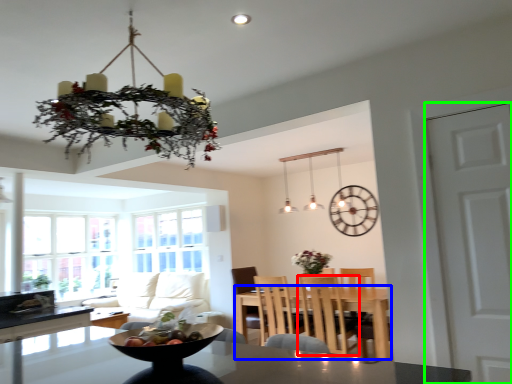
Question: Based on their relative distances, which object is nearer to chair (highlighted by a red box)? Choose from table (highlighted by a blue box) and door (highlighted by a green box).

Choices:
 (A) table
 (B) door

Answer: (A)